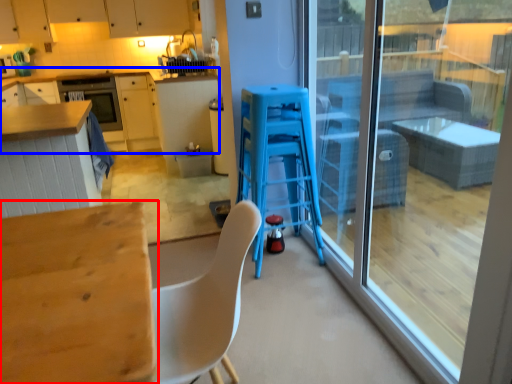
Question: Among these objects, which one is farthest to the camera, table (highlighted by a red box) or cabinetry (highlighted by a blue box)?

Choices:
 (A) table
 (B) cabinetry

Answer: (B)